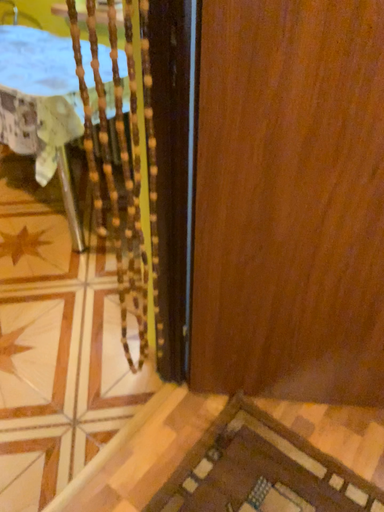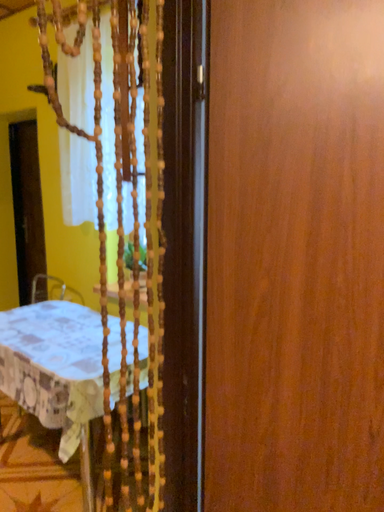
Question: How did the camera likely rotate when shooting the video?

Choices:
 (A) rotated downward
 (B) rotated upward

Answer: (B)